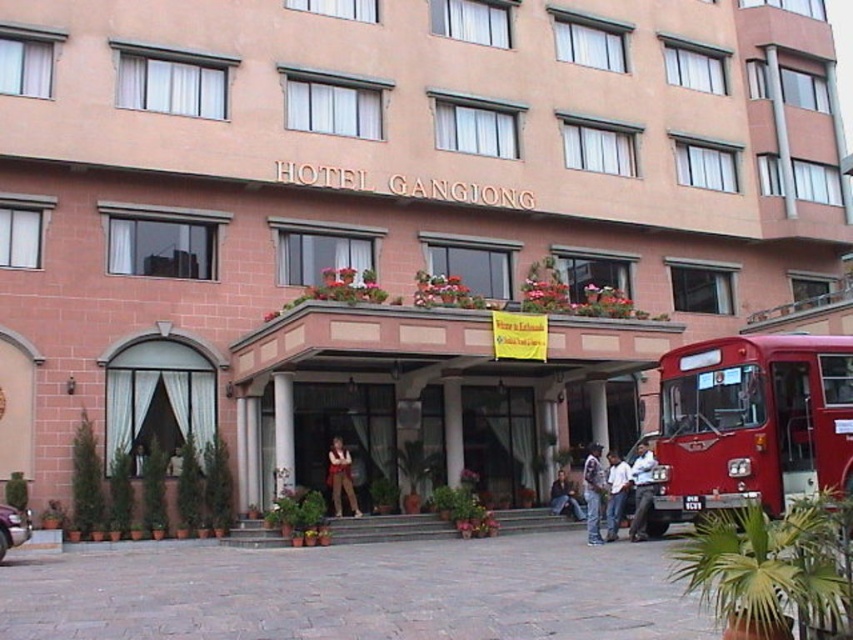
Question: Is red metallic bus at right above light brown leather jacket at lower right?

Choices:
 (A) no
 (B) yes

Answer: (B)

Question: Can you confirm if denim jacket at lower right is positioned to the left of matte brown pants at center?

Choices:
 (A) no
 (B) yes

Answer: (A)

Question: Considering the real-world distances, which object is closest to the light brown leather jacket at lower right?

Choices:
 (A) red metallic bus at right
 (B) denim jacket at lower right
 (C) white shirt at center

Answer: (B)

Question: Among these objects, which one is nearest to the camera?

Choices:
 (A) white shirt at center
 (B) light brown leather jacket at lower right
 (C) red metallic bus at right

Answer: (C)

Question: Which of the following is the farthest from the observer?

Choices:
 (A) denim jacket at lower right
 (B) white shirt at center

Answer: (A)

Question: Is denim jacket at lower right above light brown leather jacket at lower right?

Choices:
 (A) no
 (B) yes

Answer: (B)